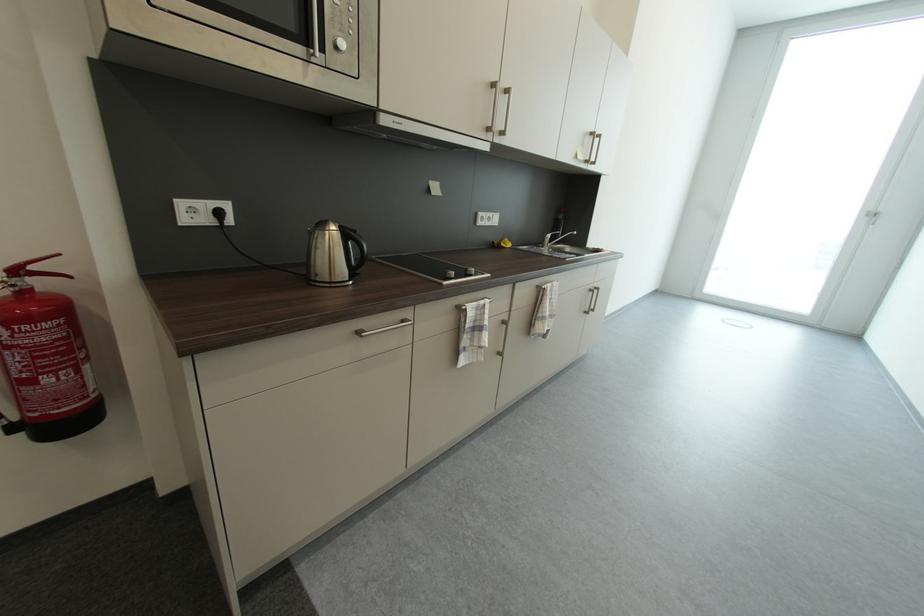
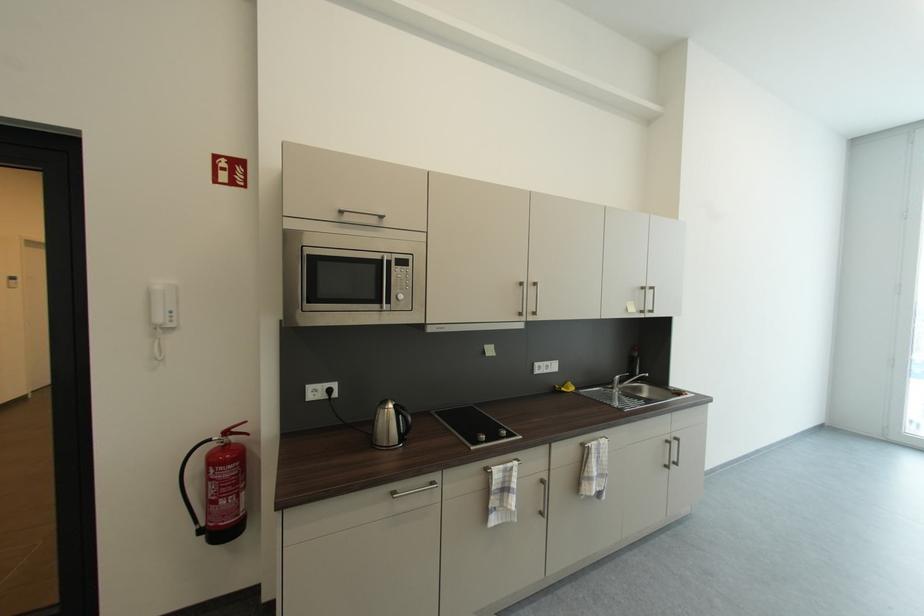
Where in the second image is the point corresponding to the point at 39,290 from the first image?

(237, 444)